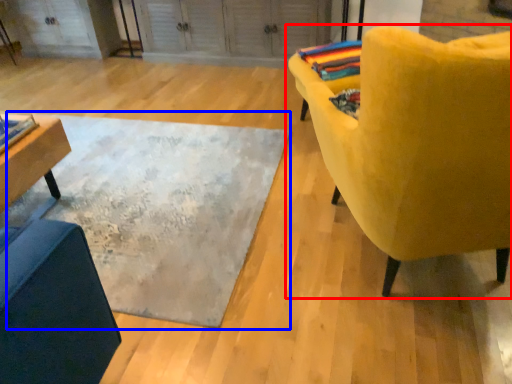
Question: Among these objects, which one is farthest to the camera, chair (highlighted by a red box) or mat (highlighted by a blue box)?

Choices:
 (A) chair
 (B) mat

Answer: (B)